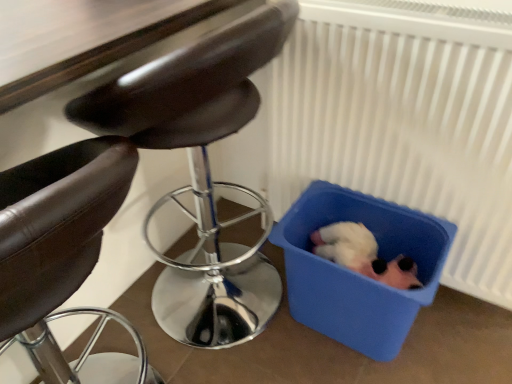
Question: From a real-world perspective, relative to leather-like brown chair at center, marked as the second chair in a left-to-right arrangement, is white plastic radiator at lower right vertically above or below?

Choices:
 (A) above
 (B) below

Answer: (B)

Question: From the image's perspective, relative to leather-like brown chair at center, marked as the second chair in a left-to-right arrangement, is white plastic radiator at lower right above or below?

Choices:
 (A) above
 (B) below

Answer: (A)

Question: Which object is the farthest from the leather-like black chair at left, which is counted as the 2th chair, starting from the right?

Choices:
 (A) blue plastic bin at lower right
 (B) white plastic radiator at lower right
 (C) leather-like brown chair at center, marked as the second chair in a left-to-right arrangement

Answer: (C)

Question: Estimate the real-world distances between objects in this image. Which object is farther from the leather-like black chair at left, acting as the 1th chair starting from the left?

Choices:
 (A) white plastic radiator at lower right
 (B) leather-like brown chair at center, marked as the second chair in a left-to-right arrangement
 (C) blue plastic bin at lower right

Answer: (B)